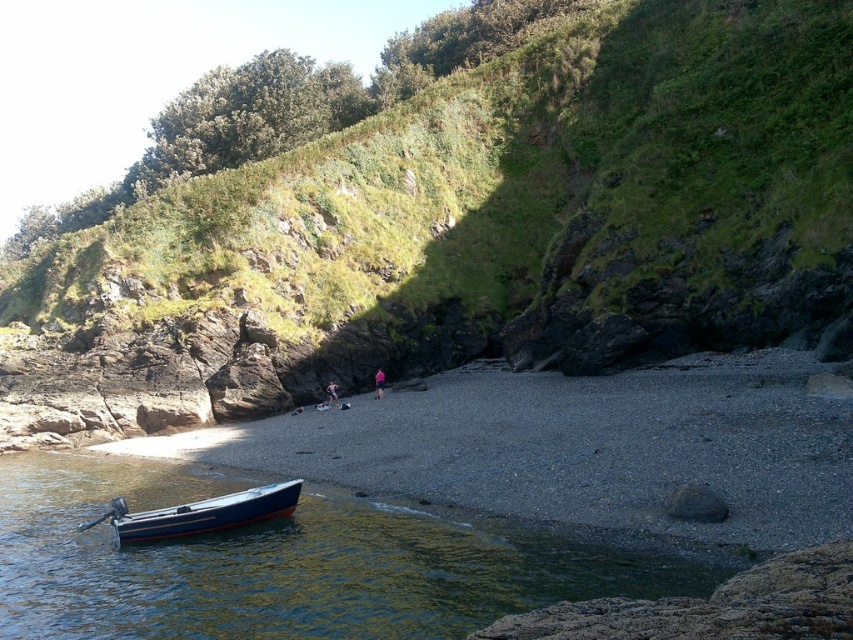
Can you confirm if green mossy rock at center is bigger than blue glossy water at lower left?

Indeed, green mossy rock at center has a larger size compared to blue glossy water at lower left.

Between point (740, 120) and point (141, 561), which one is positioned behind?

Positioned behind is point (740, 120).

The width and height of the screenshot is (853, 640). Identify the location of green mossy rock at center. (467, 227).

Does blue glossy water at lower left have a larger size compared to blue polished wood boat at lower left?

Indeed, blue glossy water at lower left has a larger size compared to blue polished wood boat at lower left.

Which is more to the right, blue glossy water at lower left or blue polished wood boat at lower left?

blue glossy water at lower left

Which is in front, point (318, 502) or point (231, 493)?

Point (231, 493) is in front.

Where is `blue glossy water at lower left`? The width and height of the screenshot is (853, 640). blue glossy water at lower left is located at coordinates (282, 563).

Is point (759, 326) more distant than point (796, 580)?

That is True.

The height and width of the screenshot is (640, 853). In order to click on green mossy rock at center in this screenshot , I will do `click(467, 227)`.

Where is `green mossy rock at center`? The width and height of the screenshot is (853, 640). green mossy rock at center is located at coordinates (467, 227).